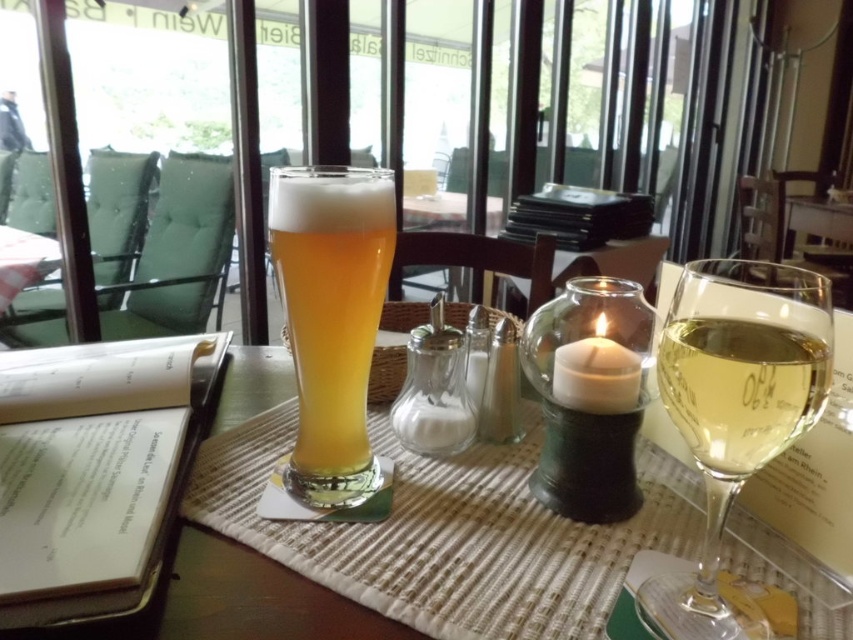
Is point (643, 532) positioned in front of point (302, 180)?

No, it is behind (302, 180).

Which is in front, point (572, 589) or point (347, 410)?

Point (572, 589) is in front.

Find the location of `clear glass table at center`. clear glass table at center is located at coordinates (451, 532).

Does point (479, 467) lie in front of point (792, 380)?

No.

Between clear glass table at center and transparent glass at right, which one has more height?

transparent glass at right is taller.

The width and height of the screenshot is (853, 640). Identify the location of clear glass table at center. (451, 532).

You are a GUI agent. You are given a task and a screenshot of the screen. Output one action in this format:
    pyautogui.click(x=<x>, y=<y>)
    Task: Click on the clear glass table at center
    
    Given the screenshot: What is the action you would take?
    pyautogui.click(x=451, y=532)

Is transparent glass at right taller than golden glass beer at center?

In fact, transparent glass at right may be shorter than golden glass beer at center.

Which is above, transparent glass at right or golden glass beer at center?

golden glass beer at center

Is point (664, 388) closer to viewer compared to point (286, 480)?

Yes.

This screenshot has width=853, height=640. In order to click on transparent glass at right in this screenshot , I will do `click(734, 410)`.